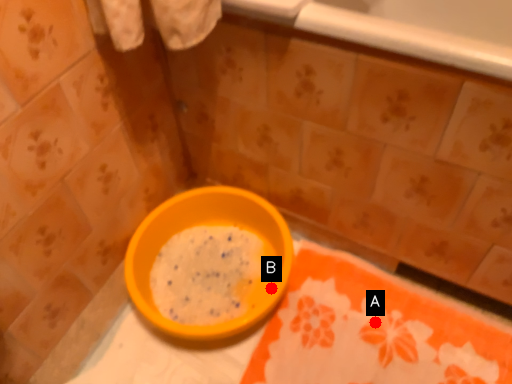
Question: Two points are circled on the image, labeled by A and B beside each circle. Which point appears closest to the camera in this image?

Choices:
 (A) A is closer
 (B) B is closer

Answer: (A)